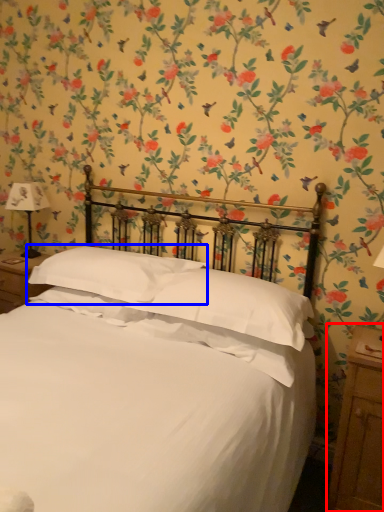
Question: Which of the following is the closest to the observer, nightstand (highlighted by a red box) or pillow (highlighted by a blue box)?

Choices:
 (A) nightstand
 (B) pillow

Answer: (A)